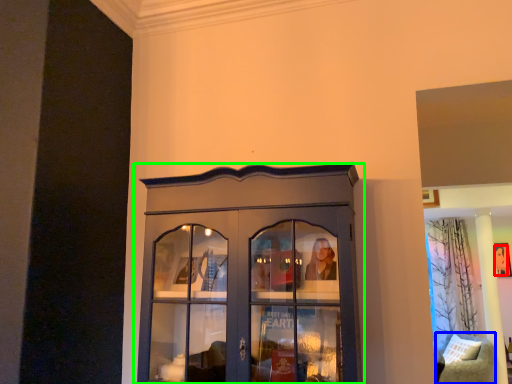
Question: Considering the real-world distances, which object is farthest from person (highlighted by a red box)? furniture (highlighted by a blue box) or cupboard (highlighted by a green box)?

Choices:
 (A) furniture
 (B) cupboard

Answer: (B)